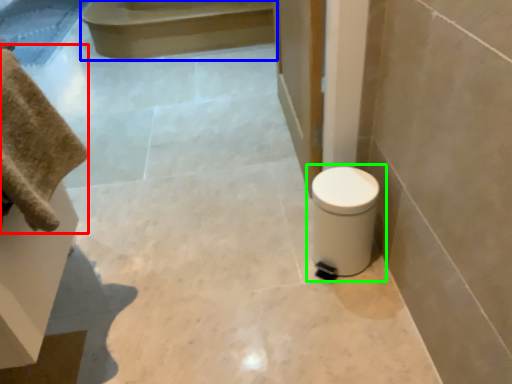
Question: Which object is positioned farthest from bath towel (highlighted by a red box)? Select from stair (highlighted by a blue box) and toilet (highlighted by a green box).

Choices:
 (A) stair
 (B) toilet

Answer: (A)